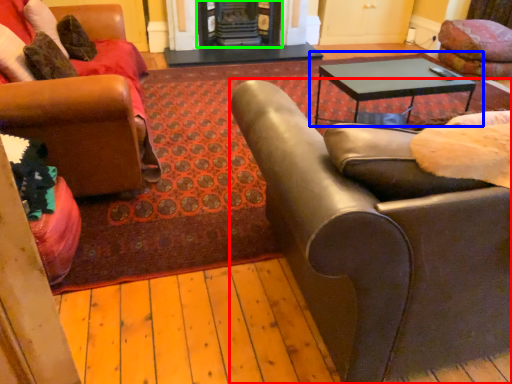
Question: Based on their relative distances, which object is farther from chair (highlighted by a red box)? Choose from coffee table (highlighted by a blue box) and fireplace (highlighted by a green box).

Choices:
 (A) coffee table
 (B) fireplace

Answer: (B)